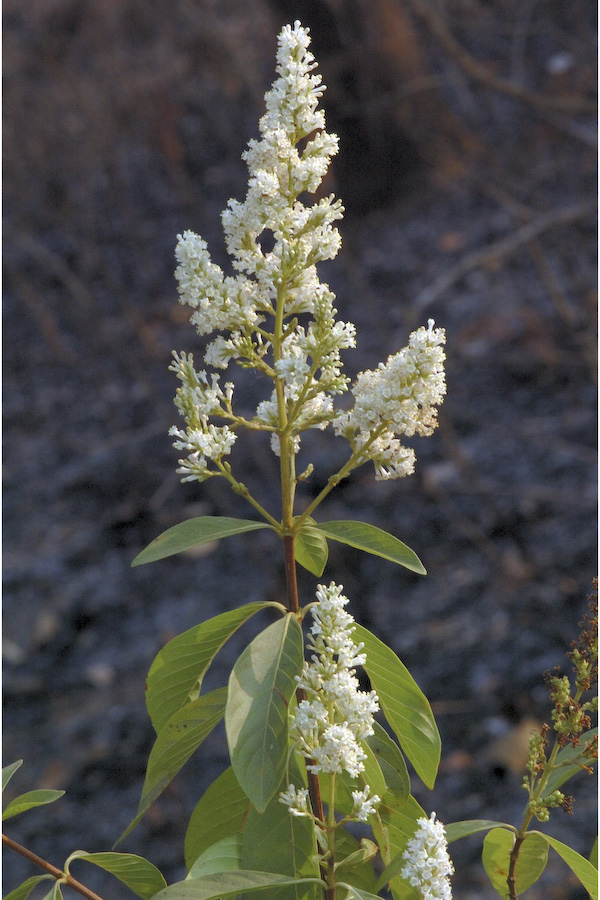
You are a GUI agent. You are given a task and a screenshot of the screen. Output one action in this format:
    pyautogui.click(x=<x>, y=<y>)
    Task: Click on the plant
    Image resolution: width=600 pixels, height=900 pixels.
    Given the screenshot: What is the action you would take?
    pyautogui.click(x=275, y=831)